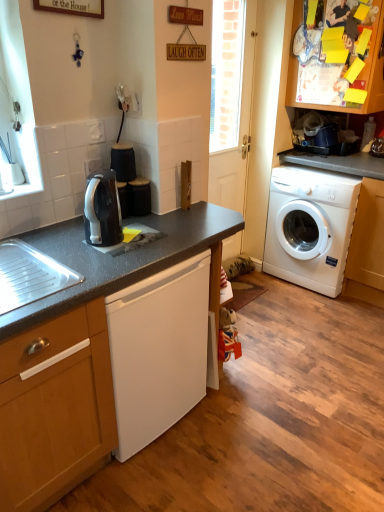
Image resolution: width=384 pixels, height=512 pixels. Find the location of `vacant area on top of wooden cabinet at lower left, which is the first cabinetry from left to right (from a real-world perspective)`. vacant area on top of wooden cabinet at lower left, which is the first cabinetry from left to right (from a real-world perspective) is located at coordinates (33, 280).